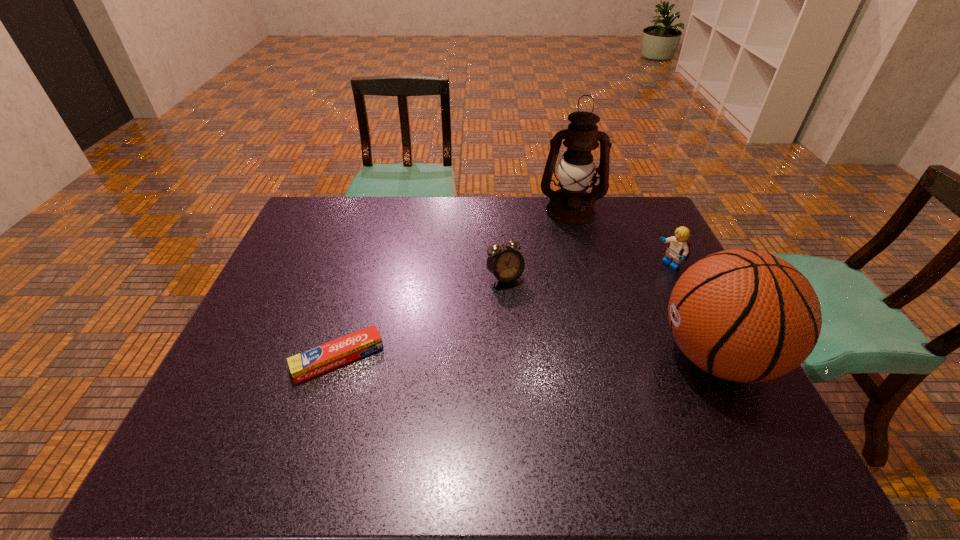
Locate which object ranks third in proximity to the farthest object. Please provide its 2D coordinates. Your answer should be formatted as a tuple, i.e. [(x, y)], where the tuple contains the x and y coordinates of a point satisfying the conditions above.

[(743, 315)]

Locate which object is the third closest to the Lego. Please provide its 2D coordinates. Your answer should be formatted as a tuple, i.e. [(x, y)], where the tuple contains the x and y coordinates of a point satisfying the conditions above.

[(506, 264)]

This screenshot has height=540, width=960. What are the coordinates of `free point that satisfies the following two spatial constraints: 1. on the back side of the fourth shortest object; 2. on the side where the inflation valve is located` in the screenshot? It's located at (339, 356).